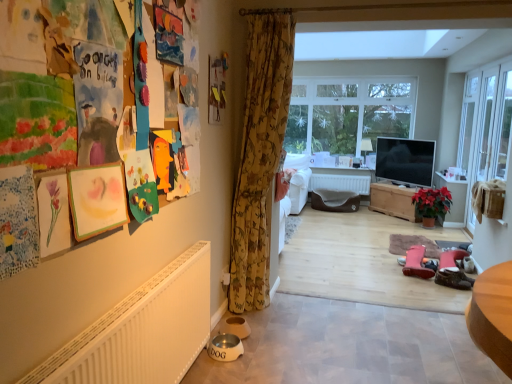
Question: Is wooden chest at center in contact with green matte poinsettia at center-right?

Choices:
 (A) yes
 (B) no

Answer: (B)

Question: Is wooden chest at center not within green matte poinsettia at center-right?

Choices:
 (A) no
 (B) yes

Answer: (B)

Question: Is wooden chest at center facing towards green matte poinsettia at center-right?

Choices:
 (A) no
 (B) yes

Answer: (A)

Question: Considering the relative positions of wooden chest at center and green matte poinsettia at center-right in the image provided, is wooden chest at center to the right of green matte poinsettia at center-right from the viewer's perspective?

Choices:
 (A) yes
 (B) no

Answer: (B)

Question: Can you confirm if wooden chest at center is positioned to the left of green matte poinsettia at center-right?

Choices:
 (A) no
 (B) yes

Answer: (B)

Question: Does point (490, 117) appear closer or farther from the camera than point (246, 256)?

Choices:
 (A) farther
 (B) closer

Answer: (A)

Question: Is clear glass screen door at right wider or thinner than floral fabric curtain at center?

Choices:
 (A) wide
 (B) thin

Answer: (B)

Question: From the image's perspective, is clear glass screen door at right above or below floral fabric curtain at center?

Choices:
 (A) below
 (B) above

Answer: (B)

Question: From a real-world perspective, relative to floral fabric curtain at center, is clear glass screen door at right vertically above or below?

Choices:
 (A) below
 (B) above

Answer: (A)

Question: Relative to white matte radiator at lower left, is brown leather shoes at lower right in front or behind?

Choices:
 (A) behind
 (B) front

Answer: (B)

Question: From the image's perspective, is brown leather shoes at lower right located above or below white matte radiator at lower left?

Choices:
 (A) above
 (B) below

Answer: (B)

Question: From a real-world perspective, is brown leather shoes at lower right positioned above or below white matte radiator at lower left?

Choices:
 (A) below
 (B) above

Answer: (A)

Question: Is brown leather shoes at lower right situated inside white matte radiator at lower left or outside?

Choices:
 (A) inside
 (B) outside

Answer: (B)

Question: Looking at their shapes, would you say brown leather shoes at lower right is wider or thinner than clear glass screen door at right?

Choices:
 (A) thin
 (B) wide

Answer: (B)

Question: Considering the relative positions of brown leather shoes at lower right and clear glass screen door at right in the image provided, is brown leather shoes at lower right to the left or to the right of clear glass screen door at right?

Choices:
 (A) right
 (B) left

Answer: (B)